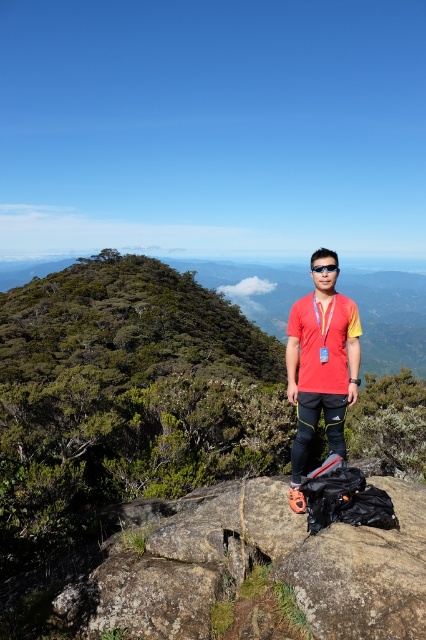
Who is higher up, rough granite rock at center or red plastic goggles at center?

Positioned higher is red plastic goggles at center.

Can you confirm if rough granite rock at center is positioned above red plastic goggles at center?

No, rough granite rock at center is not above red plastic goggles at center.

The width and height of the screenshot is (426, 640). I want to click on rough granite rock at center, so click(x=261, y=561).

Measure the distance between point (420, 540) and camera.

The distance of point (420, 540) from camera is 4.69 meters.

Can you confirm if rough granite rock at center is positioned below red matte shirt at center?

Yes, rough granite rock at center is below red matte shirt at center.

The height and width of the screenshot is (640, 426). Identify the location of rough granite rock at center. pyautogui.click(x=261, y=561).

Is point (313, 376) positioned before point (331, 266)?

No, (313, 376) is behind (331, 266).

Identify the location of red matte shirt at center. The height and width of the screenshot is (640, 426). (321, 371).